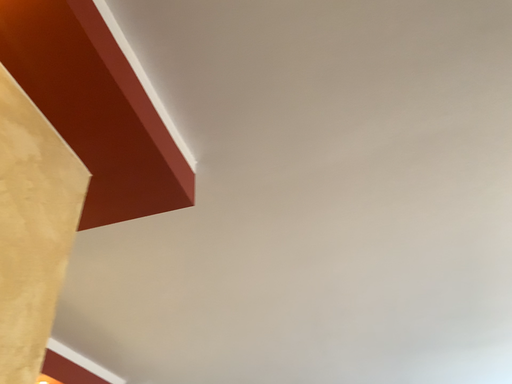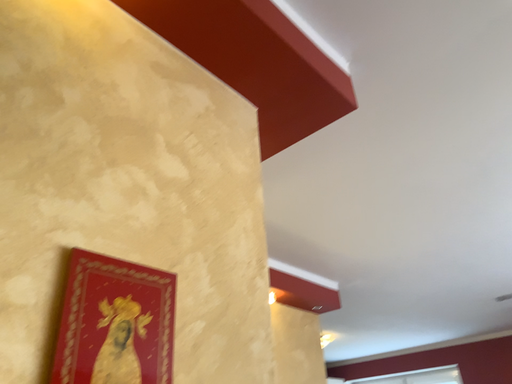
Question: How did the camera likely rotate when shooting the video?

Choices:
 (A) rotated left
 (B) rotated right

Answer: (A)